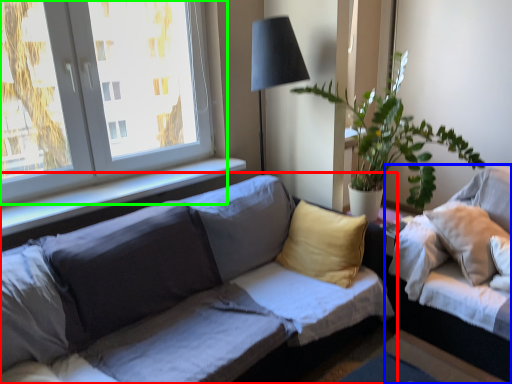
Question: Estimate the real-world distances between objects in this image. Which object is closer to studio couch (highlighted by a red box), studio couch (highlighted by a blue box) or window (highlighted by a green box)?

Choices:
 (A) studio couch
 (B) window

Answer: (A)